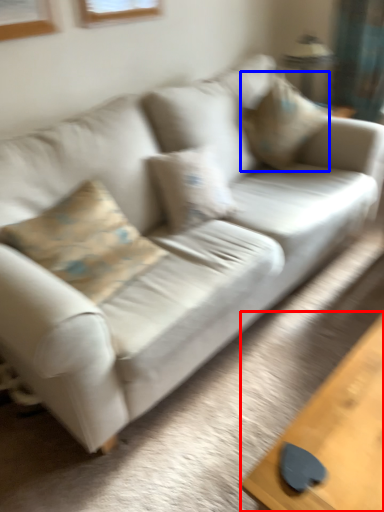
Question: Among these objects, which one is farthest to the camera, table (highlighted by a red box) or pillow (highlighted by a blue box)?

Choices:
 (A) table
 (B) pillow

Answer: (B)